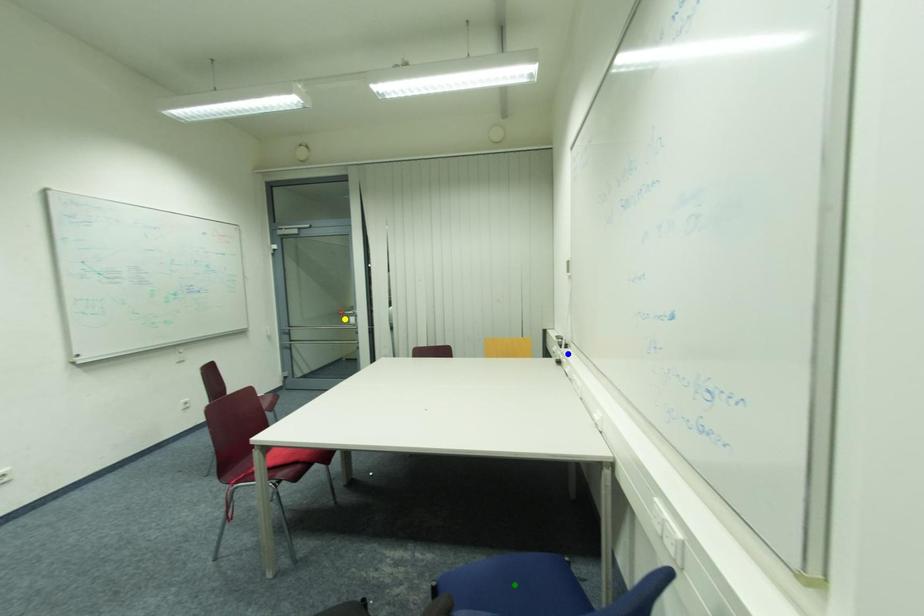
Order these from nearest to farthest:
A) blue point
B) yellow point
C) green point

green point
blue point
yellow point